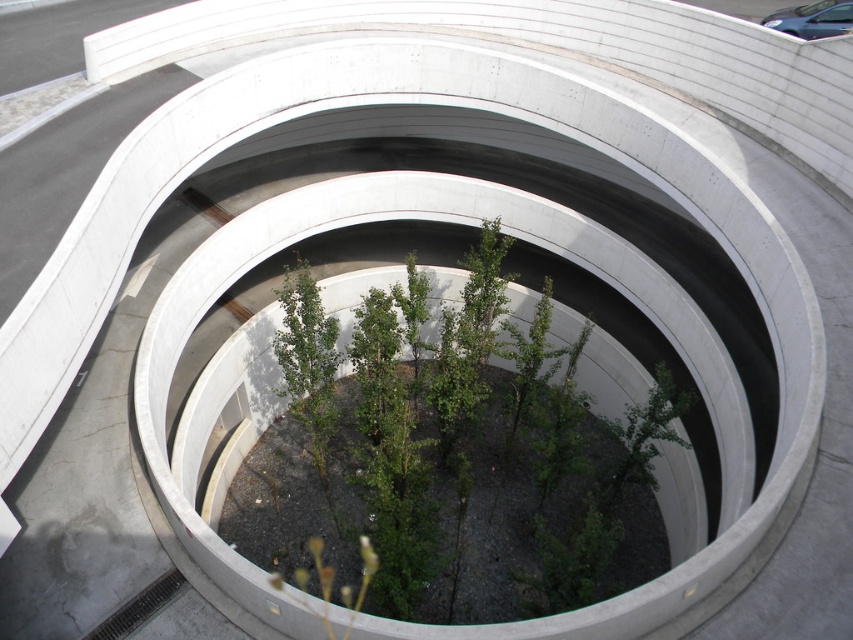
You are standing at the entrance of the parking structure and see the green leafy plant at center and the metallic gray car at upper right. Which object is closer to the center of the parking structure?

The green leafy plant at center is closer to the center of the parking structure than the metallic gray car at upper right.

You are a city planner examining this parking structure. You need to determine if the green leafy plant at center and the metallic gray car at upper right can fit side by side within a 10 meter wide space. Based on their sizes, what is your conclusion?

The green leafy plant at center is wider than the metallic gray car at upper right. However, since the exact widths are not provided, we cannot definitively determine if they can fit within 10 meters. Additional measurements are needed.